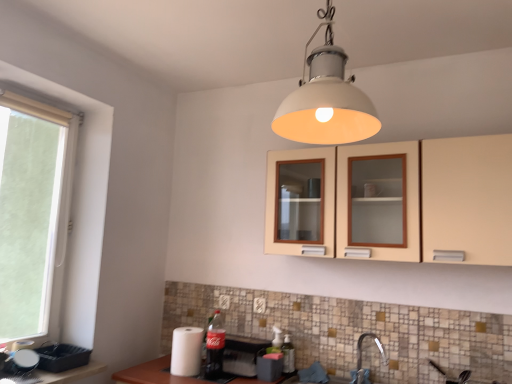
Question: Which direction should I rotate to look at white plastic electric outlet at lower center, acting as the first electric outlet starting from the back, — up or down?

Choices:
 (A) down
 (B) up

Answer: (A)

Question: Does white plastic window at left have a greater height compared to beige matte cabinet at upper center?

Choices:
 (A) yes
 (B) no

Answer: (A)

Question: Is white plastic window at left positioned before beige matte cabinet at upper center?

Choices:
 (A) no
 (B) yes

Answer: (A)

Question: Does white plastic window at left have a greater width compared to beige matte cabinet at upper center?

Choices:
 (A) no
 (B) yes

Answer: (A)

Question: Is white plastic window at left next to beige matte cabinet at upper center?

Choices:
 (A) no
 (B) yes

Answer: (A)

Question: From the image's perspective, is white plastic window at left located beneath beige matte cabinet at upper center?

Choices:
 (A) no
 (B) yes

Answer: (B)

Question: From the image's perspective, does white plastic window at left appear higher than beige matte cabinet at upper center?

Choices:
 (A) no
 (B) yes

Answer: (A)

Question: Is matte plastic coca-cola bottle at lower center, the first bottle when ordered from left to right, located within matte plastic tray at lower left?

Choices:
 (A) no
 (B) yes

Answer: (A)

Question: Is matte plastic tray at lower left behind matte plastic coca-cola bottle at lower center, the first bottle when ordered from left to right?

Choices:
 (A) yes
 (B) no

Answer: (B)

Question: Does matte plastic tray at lower left have a smaller size compared to matte plastic coca-cola bottle at lower center, the second bottle positioned from the right?

Choices:
 (A) yes
 (B) no

Answer: (B)

Question: From a real-world perspective, does matte plastic tray at lower left stand above matte plastic coca-cola bottle at lower center, the first bottle when ordered from left to right?

Choices:
 (A) yes
 (B) no

Answer: (B)

Question: Can you confirm if matte plastic tray at lower left is positioned to the right of matte plastic coca-cola bottle at lower center, the first bottle when ordered from left to right?

Choices:
 (A) yes
 (B) no

Answer: (B)

Question: Considering the relative sizes of matte plastic tray at lower left and matte plastic coca-cola bottle at lower center, the first bottle when ordered from left to right, in the image provided, is matte plastic tray at lower left bigger than matte plastic coca-cola bottle at lower center, the first bottle when ordered from left to right,?

Choices:
 (A) no
 (B) yes

Answer: (B)

Question: Can you see white paper towel at lower left, which is counted as the 2th appliance, starting from the right, touching white matte lampshade at upper center?

Choices:
 (A) yes
 (B) no

Answer: (B)